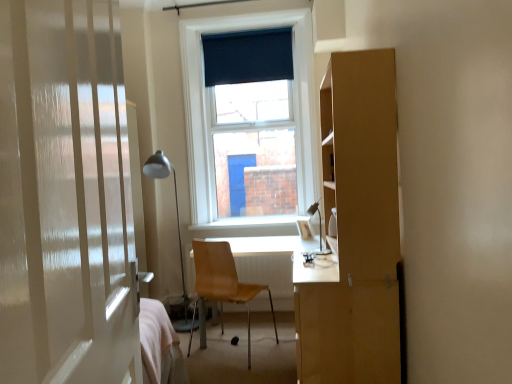
Question: From a real-world perspective, is matte silver table lamp at center, which is the first table lamp from right to left, physically located above or below metallic silver table lamp at left, placed as the second table lamp when sorted from right to left?

Choices:
 (A) above
 (B) below

Answer: (A)

Question: Considering the positions of matte silver table lamp at center, which is counted as the first table lamp, starting from the front, and metallic silver table lamp at left, placed as the second table lamp when sorted from right to left, in the image, is matte silver table lamp at center, which is counted as the first table lamp, starting from the front, wider or thinner than metallic silver table lamp at left, placed as the second table lamp when sorted from right to left,?

Choices:
 (A) thin
 (B) wide

Answer: (A)

Question: Considering the real-world distances, which object is closest to the matte silver table lamp at center, which appears as the 2th table lamp when viewed from the left?

Choices:
 (A) white glossy door at left
 (B) white smooth window sill at center
 (C) light brown wooden desk at center
 (D) wooden chair at center
 (E) metallic silver table lamp at left, arranged as the 2th table lamp when viewed from the front

Answer: (D)

Question: Estimate the real-world distances between objects in this image. Which object is farther from the metallic silver table lamp at left, placed as the second table lamp when sorted from right to left?

Choices:
 (A) light brown wooden desk at center
 (B) wooden chair at center
 (C) dark blue fabric at upper center
 (D) white smooth window sill at center
 (E) white glossy door at left

Answer: (E)